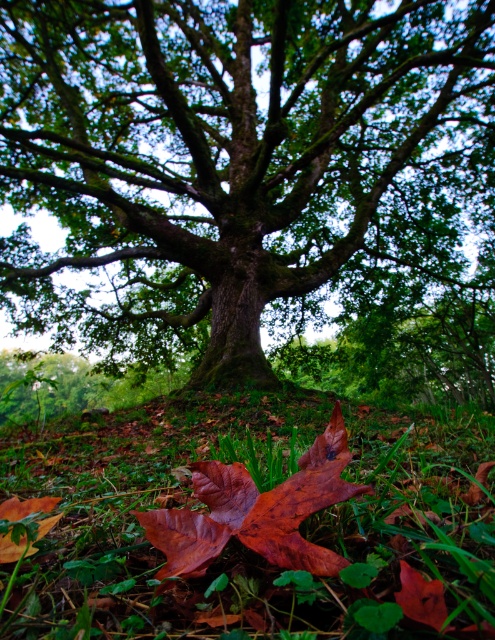
Question: Can you confirm if green rough bark tree at center is positioned below green matte grass at lower center?

Choices:
 (A) no
 (B) yes

Answer: (A)

Question: Which point appears closest to the camera in this image?

Choices:
 (A) (169, 404)
 (B) (134, 168)
 (C) (426, 588)
 (D) (295, 474)

Answer: (C)

Question: Where is green matte grass at lower center located in relation to shiny brown leaf at center in the image?

Choices:
 (A) left
 (B) right

Answer: (B)

Question: Can you confirm if green rough bark tree at center is thinner than green matte grass at lower center?

Choices:
 (A) yes
 (B) no

Answer: (B)

Question: Which point is farther from the camera taking this photo?

Choices:
 (A) (190, 570)
 (B) (182, 557)

Answer: (B)

Question: Which object is the farthest from the shiny brown maple leaf at center?

Choices:
 (A) shiny brown leaf at center
 (B) green rough bark tree at center
 (C) green matte grass at lower center

Answer: (B)